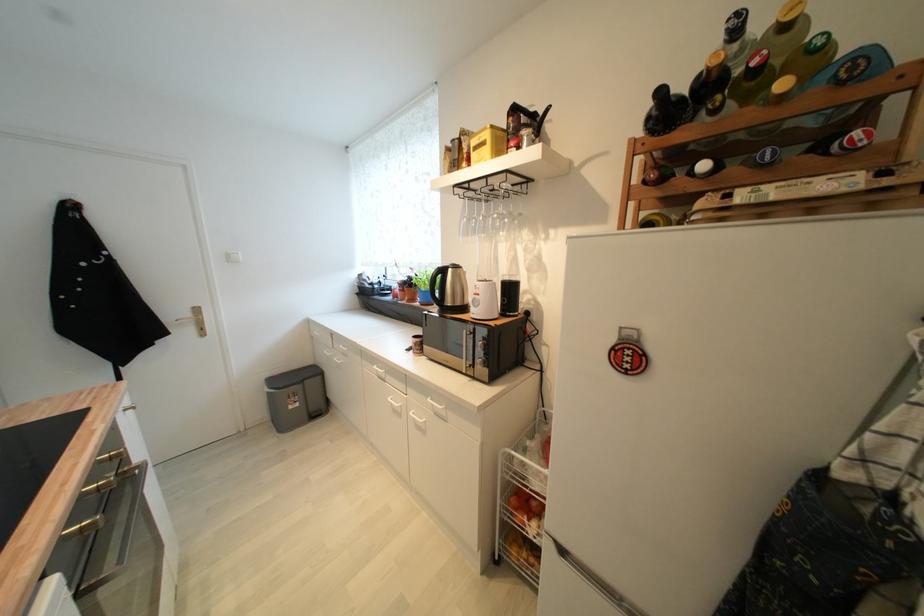
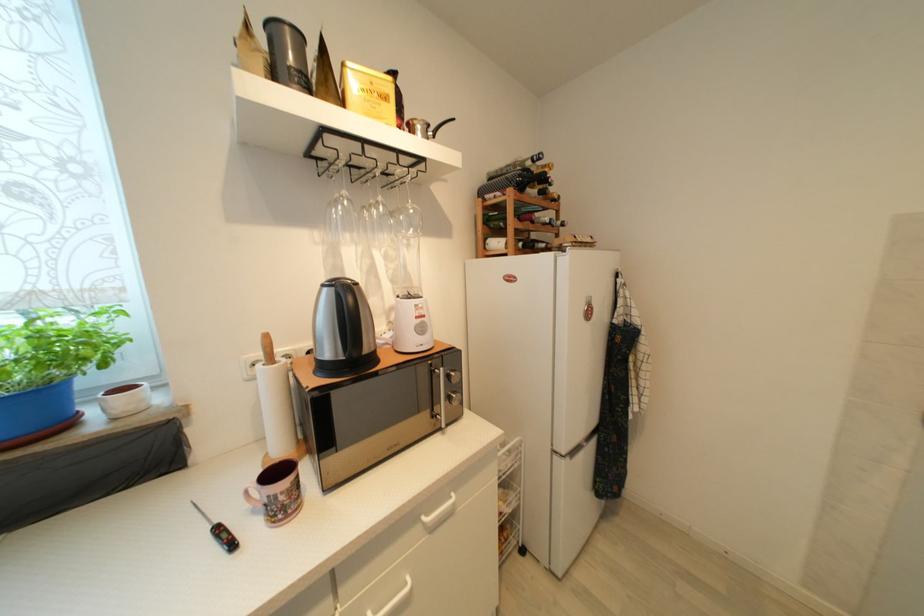
Find the pixel in the second image that matches (546,245) in the first image.

(409, 253)